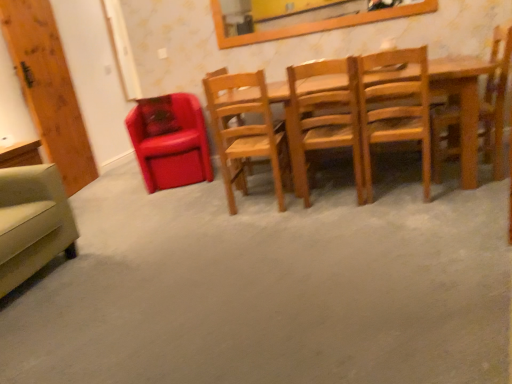
Locate an element on the screen. Image resolution: width=512 pixels, height=384 pixels. empty space that is in between beige fabric armchair at lower left, the 1th chair positioned from the left, and wooden chair at center, arranged as the 3th chair when viewed from the right is located at coordinates (157, 243).